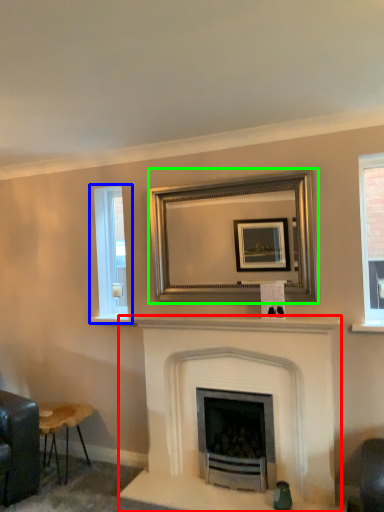
Question: Which object is the farthest from fireplace (highlighted by a red box)? Choose among these: window (highlighted by a blue box) or picture frame (highlighted by a green box).

Choices:
 (A) window
 (B) picture frame

Answer: (A)